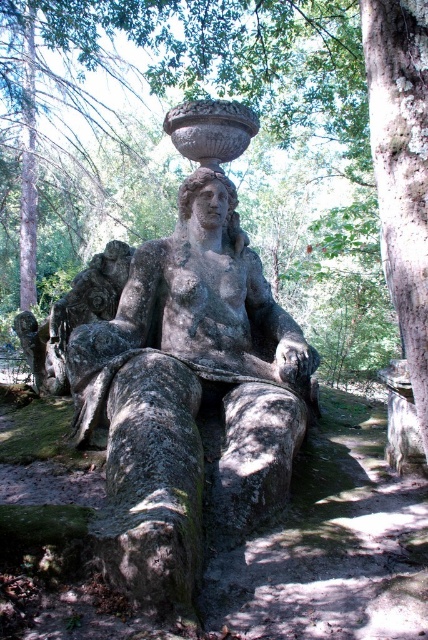
You are a painter wanting to capture the scene. You need to decide which object, the smooth bark tree trunk at right or the gray stone statue at center, you should paint first if you want to follow the rule of painting taller objects before shorter ones. Which one should you choose?

The smooth bark tree trunk at right is taller than the gray stone statue at center, so you should paint the smooth bark tree trunk at right first.

You are a painter setting up an easel to paint the trees in the background of the statue. You want to capture the width comparison between the green rough bark tree at upper center and the smooth bark tree trunk at right. Which tree should you focus on first to ensure you accurately depict their widths?

You should focus on the green rough bark tree at upper center first because its width surpasses the smooth bark tree trunk at right, so capturing its broader width accurately is essential for the comparison.

You are standing at the base of the statue and want to place a small potted plant exactly at point (306, 97). What object will the potted plant be placed under?

The potted plant will be placed under the green rough bark tree at upper center located at point (306, 97).